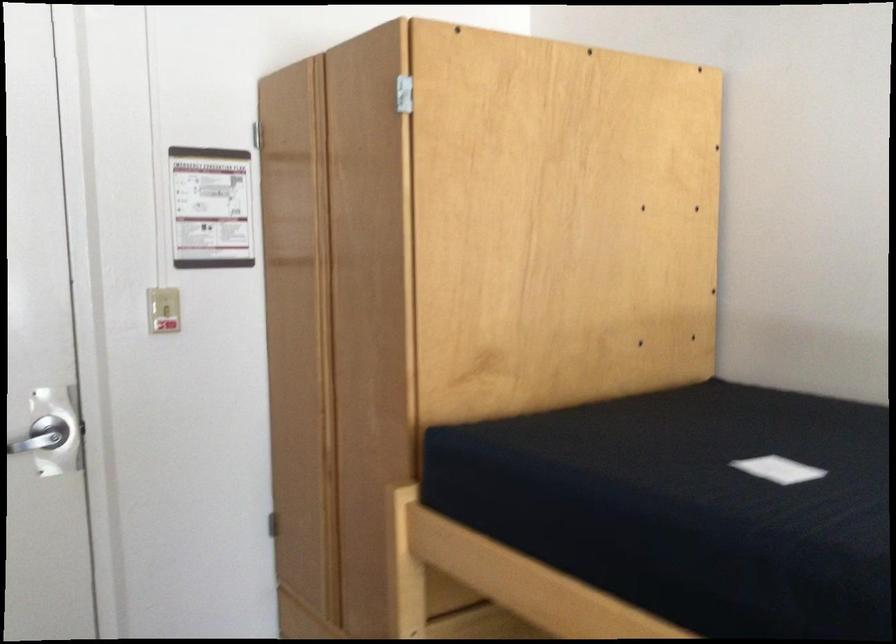
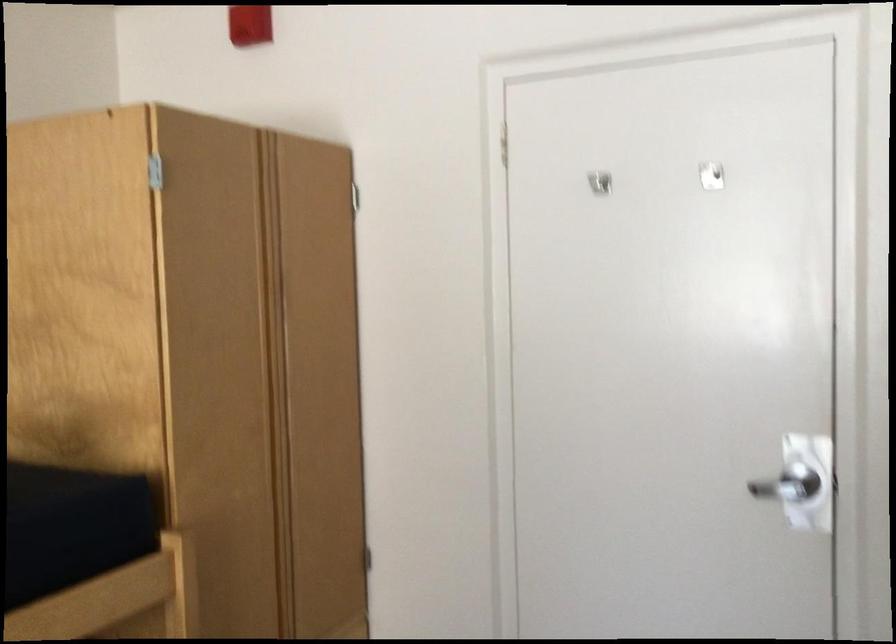
Question: The camera is either moving clockwise (left) or counter-clockwise (right) around the object. The first image is from the beginning of the video and the second image is from the end. Is the camera moving left or right when shooting the video?

Choices:
 (A) Left
 (B) Right

Answer: (B)